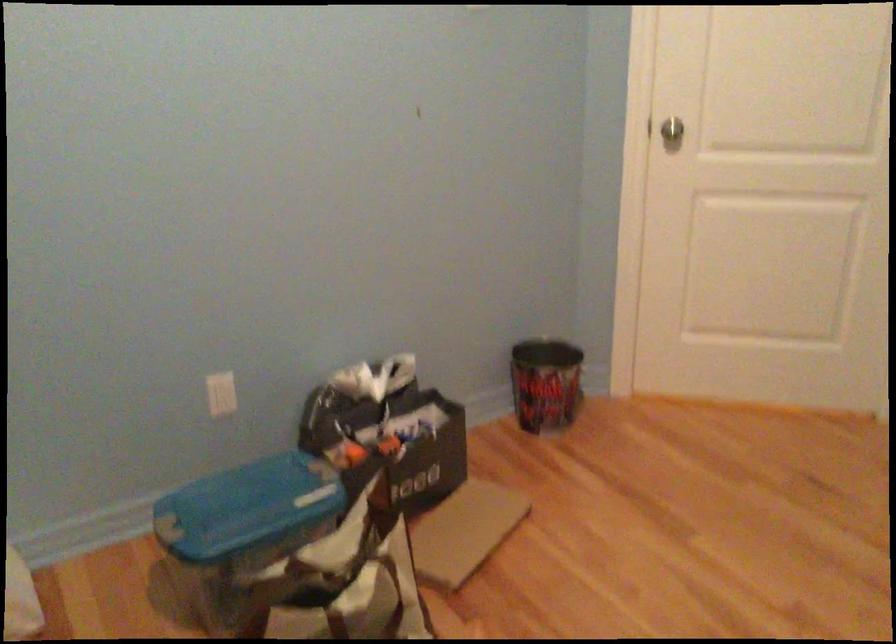
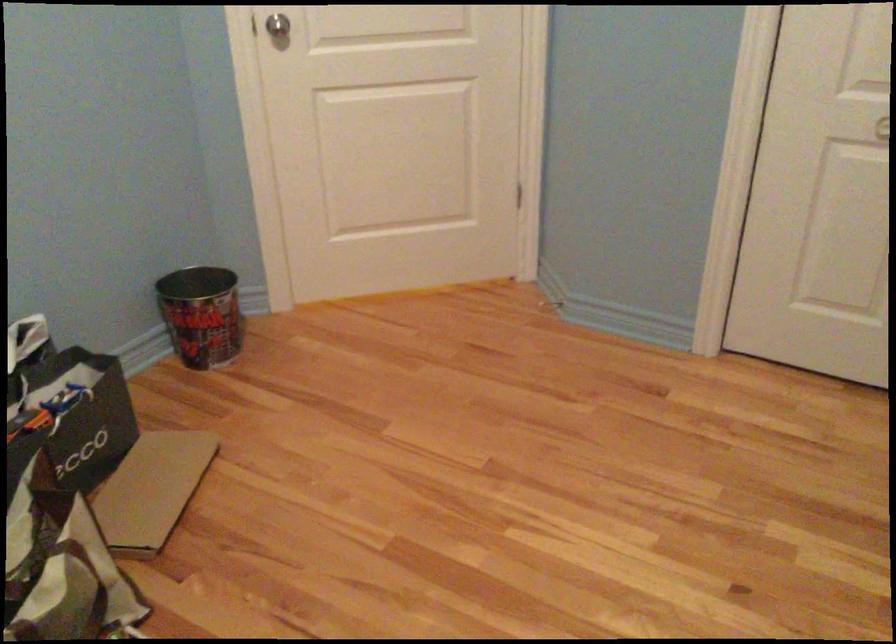
Question: In a continuous first-person perspective shot, in which direction is the camera moving?

Choices:
 (A) Left
 (B) Right
 (C) Forward
 (D) Backward

Answer: (C)